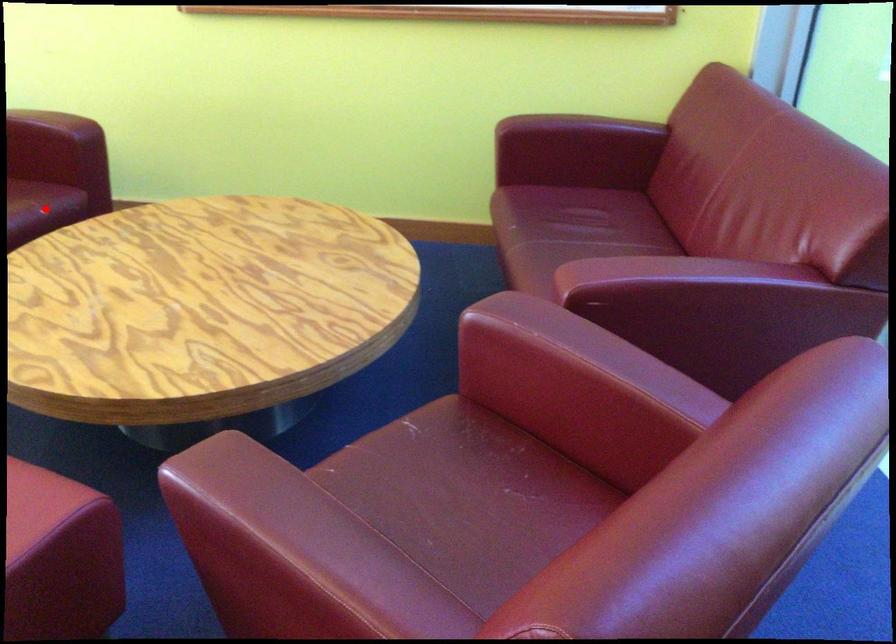
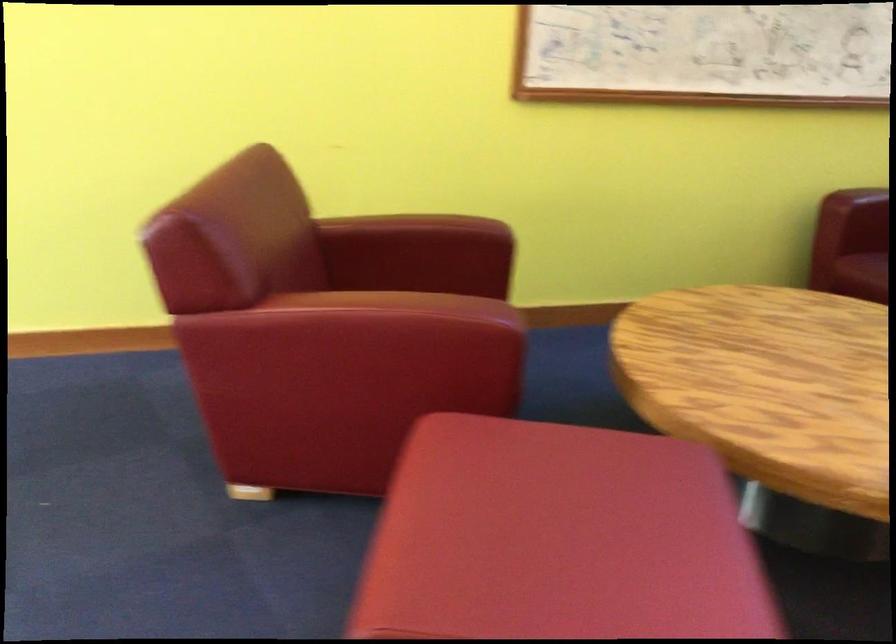
Question: I am providing you with two images of the same scene from different viewpoints. A red point is marked on the first image. Is the red point's position out of view in image 2?

Choices:
 (A) Yes
 (B) No

Answer: (A)